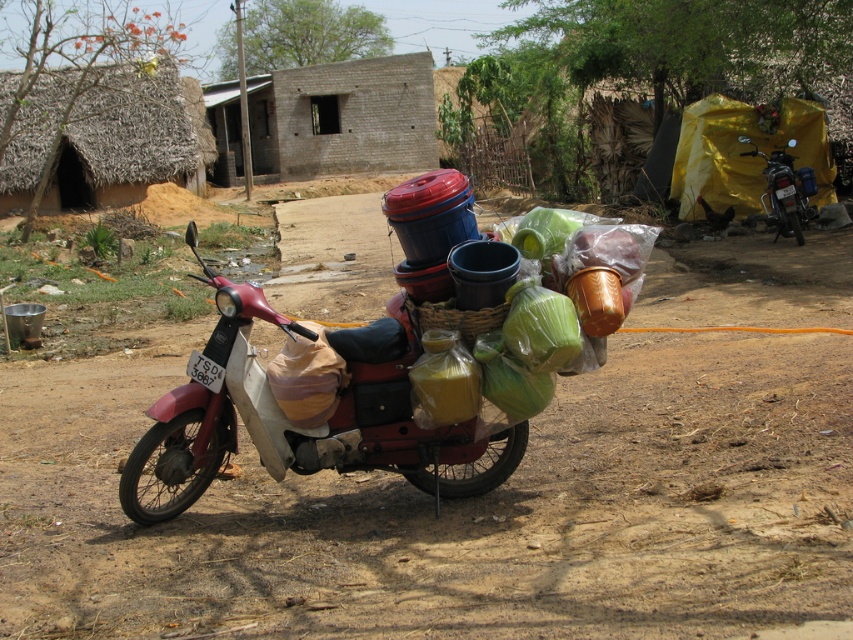
You need to park your vehicle in a narrow alley that can only accommodate vehicles up to 2 meters in width. You have a metallic red scooter at center and a metallic silver motorcycle at right. Which vehicle should you choose to ensure it fits within the alley?

The metallic red scooter at center might be wider than the metallic silver motorcycle at right, so to ensure it fits within the alley, you should choose the metallic silver motorcycle at right.